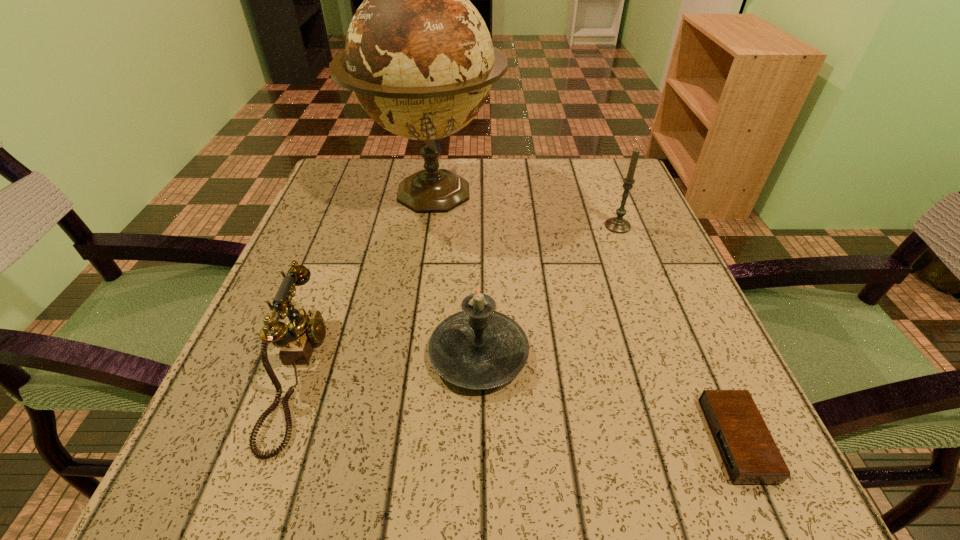
At what (x,y) coordinates should I click in order to perform the action: click on alarm clock that is at the right edge. Please return your answer as a coordinate pair (x, y). Looking at the image, I should click on (750, 455).

Find the location of `object located at the far left corner`. object located at the far left corner is located at coordinates (419, 58).

This screenshot has height=540, width=960. What are the coordinates of `object located at the near left corner` in the screenshot? It's located at pyautogui.click(x=297, y=339).

At what (x,y) coordinates should I click in order to perform the action: click on object located at the near right corner. Please return your answer as a coordinate pair (x, y). The width and height of the screenshot is (960, 540). Looking at the image, I should click on (750, 455).

Where is `vacant region at the far edge of the desktop`? The height and width of the screenshot is (540, 960). vacant region at the far edge of the desktop is located at coordinates (495, 181).

This screenshot has width=960, height=540. I want to click on free region at the near edge of the desktop, so click(x=342, y=480).

Image resolution: width=960 pixels, height=540 pixels. Find the location of `free space at the left edge`. free space at the left edge is located at coordinates (x=284, y=364).

In the image, there is a desktop. At what (x,y) coordinates should I click in order to perform the action: click on free region at the right edge. Please return your answer as a coordinate pair (x, y). Looking at the image, I should click on (664, 435).

Locate an element on the screen. This screenshot has height=540, width=960. vacant area at the far left corner of the desktop is located at coordinates (389, 170).

Where is `vacant area at the near left corner`? vacant area at the near left corner is located at coordinates (265, 496).